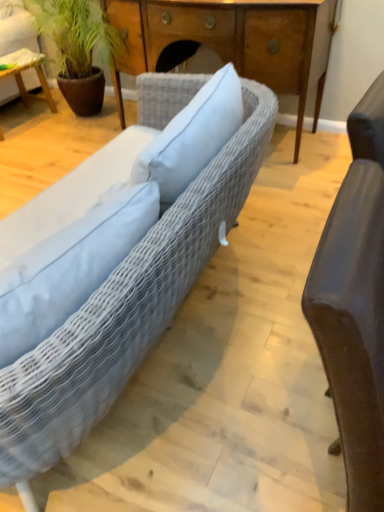
Question: Is wooden desk at center not inside woven fabric couch at center?

Choices:
 (A) yes
 (B) no

Answer: (A)

Question: Is wooden desk at center taller than woven fabric couch at center?

Choices:
 (A) yes
 (B) no

Answer: (A)

Question: Does wooden desk at center appear on the right side of woven fabric couch at center?

Choices:
 (A) no
 (B) yes

Answer: (B)

Question: Can you confirm if wooden desk at center is wider than woven fabric couch at center?

Choices:
 (A) no
 (B) yes

Answer: (A)

Question: Is woven fabric couch at center inside wooden desk at center?

Choices:
 (A) no
 (B) yes

Answer: (A)

Question: From a real-world perspective, is wooden desk at center on woven fabric couch at center?

Choices:
 (A) yes
 (B) no

Answer: (A)

Question: Considering the relative positions of woven fabric couch at center and wooden table at left in the image provided, is woven fabric couch at center in front of wooden table at left?

Choices:
 (A) no
 (B) yes

Answer: (B)

Question: Is woven fabric couch at center wider than wooden table at left?

Choices:
 (A) no
 (B) yes

Answer: (B)

Question: From the image's perspective, is woven fabric couch at center located beneath wooden table at left?

Choices:
 (A) yes
 (B) no

Answer: (A)

Question: Does woven fabric couch at center have a larger size compared to wooden table at left?

Choices:
 (A) no
 (B) yes

Answer: (B)

Question: Is woven fabric couch at center not close to wooden table at left?

Choices:
 (A) yes
 (B) no

Answer: (A)

Question: Considering the relative sizes of woven fabric couch at center and wooden table at left in the image provided, is woven fabric couch at center smaller than wooden table at left?

Choices:
 (A) yes
 (B) no

Answer: (B)

Question: From a real-world perspective, is wooden table at left positioned under matte brown leather chair at right based on gravity?

Choices:
 (A) yes
 (B) no

Answer: (A)